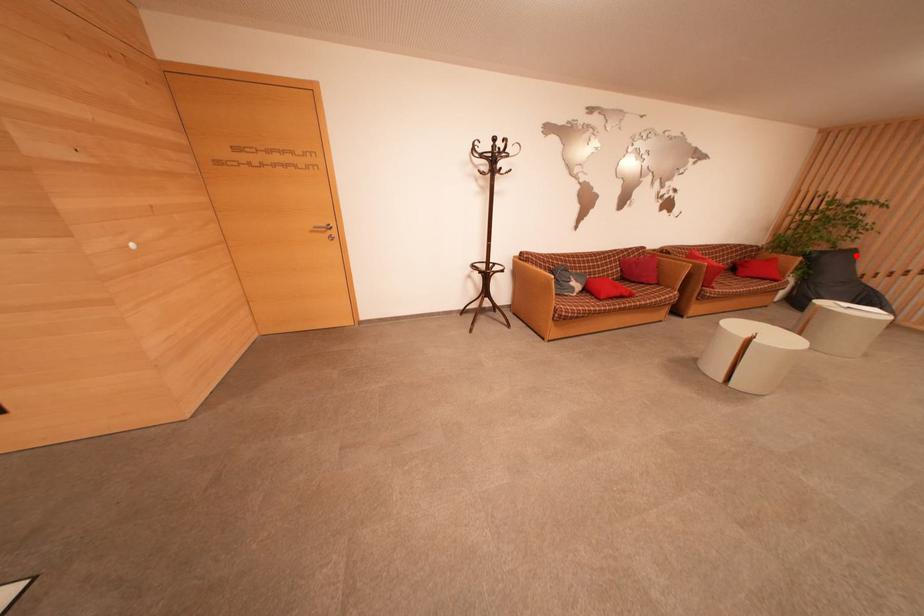
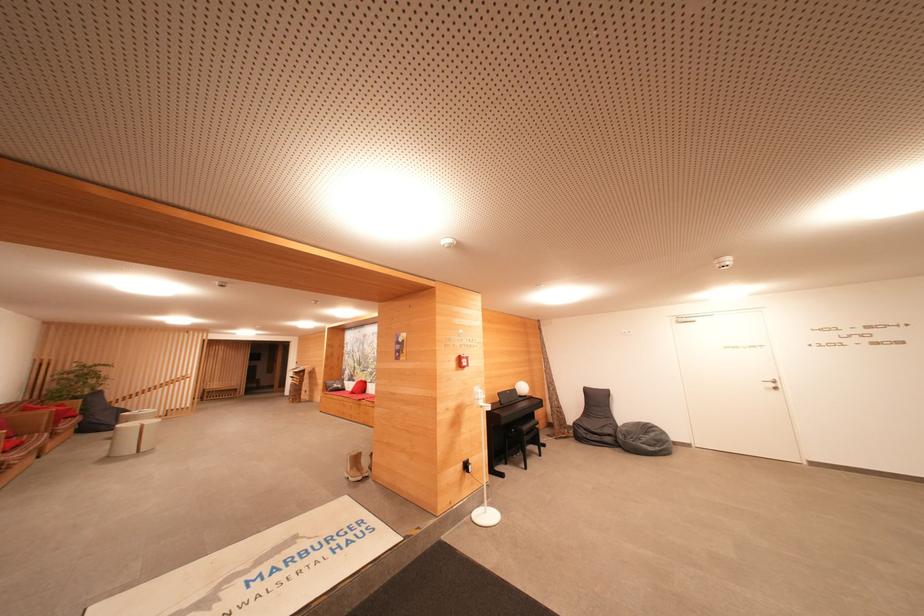
Locate, in the second image, the point that corresponds to the highlighted location in the first image.

(103, 395)